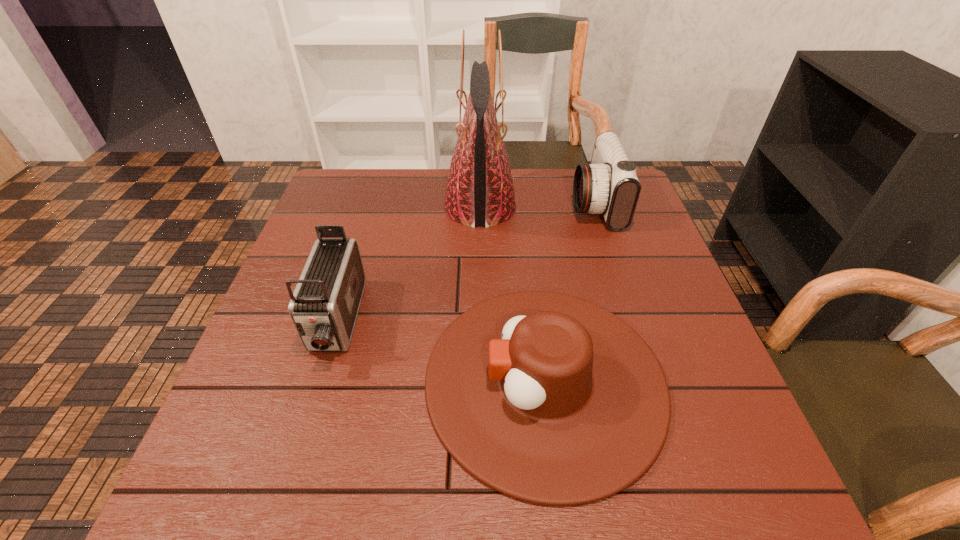
At what (x,y) coordinates should I click in order to perform the action: click on vacant position located 0.250m on the front-facing side of the cowboy hat. Please return your answer as a coordinate pair (x, y). The width and height of the screenshot is (960, 540). Looking at the image, I should click on (295, 380).

The width and height of the screenshot is (960, 540). Find the location of `vacant space positioned on the front-facing side of the cowboy hat`. vacant space positioned on the front-facing side of the cowboy hat is located at coordinates (378, 380).

The image size is (960, 540). What are the coordinates of `free space located on the front-facing side of the cowboy hat` in the screenshot? It's located at (257, 380).

Where is `handbag located at the far edge`? handbag located at the far edge is located at coordinates (479, 191).

The image size is (960, 540). What are the coordinates of `camcorder positioned at the far edge` in the screenshot? It's located at (609, 185).

Locate an element on the screen. Image resolution: width=960 pixels, height=540 pixels. object that is positioned at the near edge is located at coordinates (548, 398).

At what (x,y) coordinates should I click in order to perform the action: click on object that is at the left edge. Please return your answer as a coordinate pair (x, y). The height and width of the screenshot is (540, 960). Looking at the image, I should click on (324, 306).

Find the location of a particular element. This screenshot has width=960, height=540. camcorder that is at the right edge is located at coordinates click(x=609, y=185).

Where is `cowboy hat that is at the right edge`? The height and width of the screenshot is (540, 960). cowboy hat that is at the right edge is located at coordinates (548, 398).

This screenshot has height=540, width=960. Identify the location of object that is at the far right corner. (609, 185).